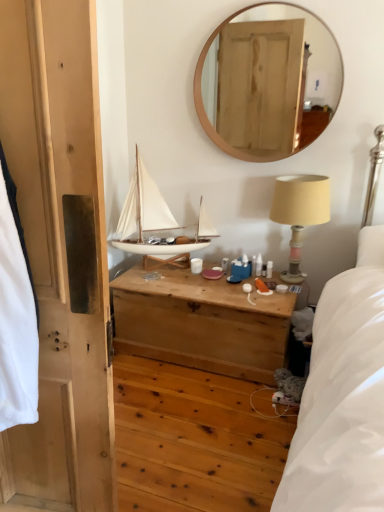
Question: From a real-world perspective, is wooden chest at center beneath wooden mirror at upper center?

Choices:
 (A) no
 (B) yes

Answer: (B)

Question: Does wooden chest at center appear on the right side of wooden mirror at upper center?

Choices:
 (A) no
 (B) yes

Answer: (A)

Question: Is wooden chest at center positioned beyond the bounds of wooden mirror at upper center?

Choices:
 (A) yes
 (B) no

Answer: (A)

Question: Does wooden chest at center have a larger size compared to wooden mirror at upper center?

Choices:
 (A) no
 (B) yes

Answer: (B)

Question: Can you confirm if wooden chest at center is thinner than wooden mirror at upper center?

Choices:
 (A) no
 (B) yes

Answer: (A)

Question: Relative to white matte sailboat at center, is wooden chest at center in front or behind?

Choices:
 (A) behind
 (B) front

Answer: (B)

Question: From the image's perspective, relative to white matte sailboat at center, is wooden chest at center above or below?

Choices:
 (A) above
 (B) below

Answer: (B)

Question: Would you say wooden chest at center is to the left or to the right of white matte sailboat at center in the picture?

Choices:
 (A) left
 (B) right

Answer: (B)

Question: Would you say wooden chest at center is inside or outside white matte sailboat at center?

Choices:
 (A) outside
 (B) inside

Answer: (A)

Question: Based on their sizes in the image, would you say wooden door at left is bigger or smaller than white matte sailboat at center?

Choices:
 (A) small
 (B) big

Answer: (A)

Question: Is wooden door at left in front of or behind white matte sailboat at center in the image?

Choices:
 (A) behind
 (B) front

Answer: (B)

Question: From their relative heights in the image, would you say wooden door at left is taller or shorter than white matte sailboat at center?

Choices:
 (A) short
 (B) tall

Answer: (B)

Question: From a real-world perspective, is wooden door at left physically located above or below white matte sailboat at center?

Choices:
 (A) below
 (B) above

Answer: (B)

Question: Is point (324, 216) closer or farther from the camera than point (139, 181)?

Choices:
 (A) closer
 (B) farther

Answer: (A)

Question: In the image, is beige fabric-covered lampshade at upper right on the left side or the right side of white matte sailboat at center?

Choices:
 (A) left
 (B) right

Answer: (B)